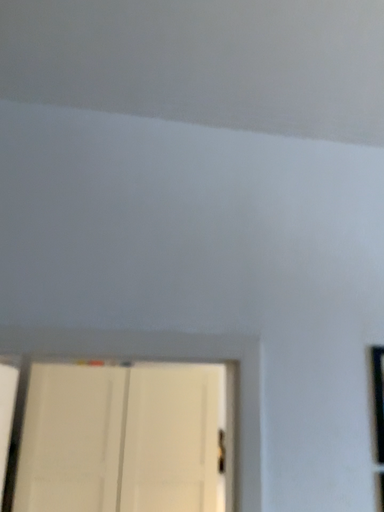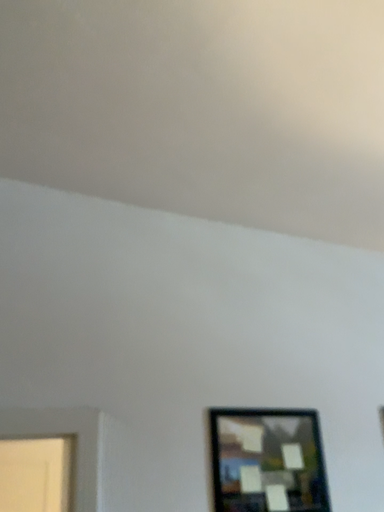
Question: Which way did the camera rotate in the video?

Choices:
 (A) rotated left
 (B) rotated right

Answer: (B)